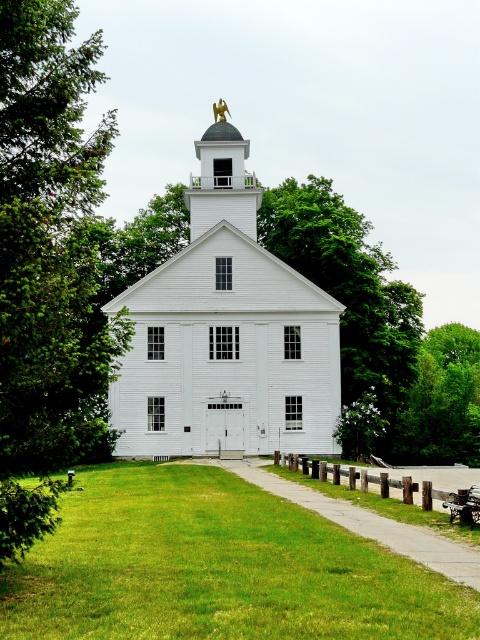
You are a visitor approaching the church and notice the gravel path at center and the gold plated eagle at upper center. Which object would you see as larger from your current viewpoint?

The gravel path at center is bigger than the gold plated eagle at upper center, so you would see the gravel path at center as larger from your current viewpoint.

You are standing on the grassy lawn in front of the church. You want to take a photo of the white matte church at center with the green leafy tree at left in the background. Will the tree be visible behind the church in your photo?

The green leafy tree at left is taller than the white matte church at center, so yes, the tree will be visible behind the church in your photo.

You are standing at the edge of the green grass at center and want to reach the white matte church at center. If your walking speed is 3 feet per second, how many seconds will it take you to walk directly to the church?

The distance between the green grass at center and the white matte church at center is 89.64 feet. At a walking speed of 3 feet per second, it would take 89.64 divided by 3, which equals approximately 29.88 seconds. So, it will take about 30 seconds to reach the church.